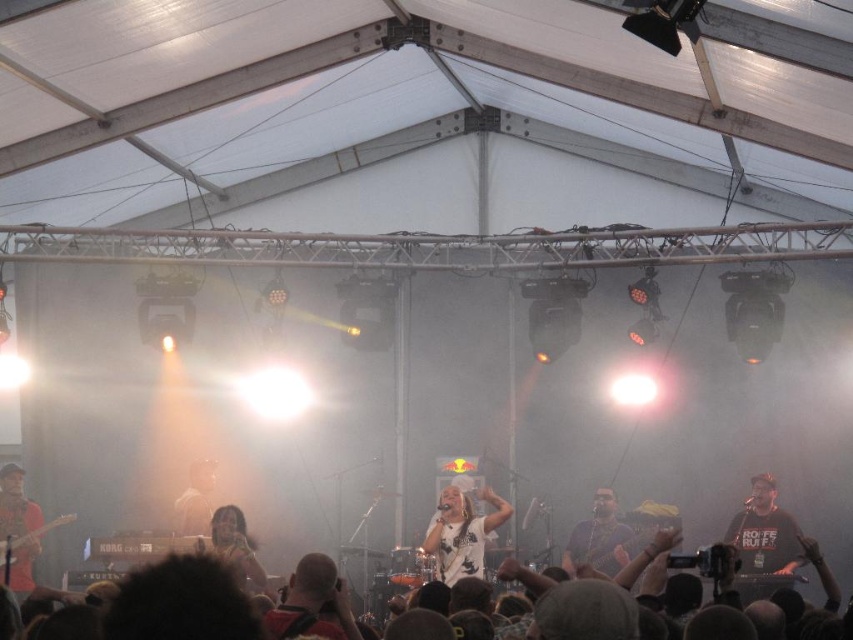
Question: Considering the real-world distances, which object is farthest from the matte black guitar at left?

Choices:
 (A) matte brown shirt at center
 (B) shiny black shirt at center
 (C) matte white shirt at center

Answer: (B)

Question: Can you confirm if shiny black shirt at center is positioned to the left of matte black guitar at left?

Choices:
 (A) no
 (B) yes

Answer: (A)

Question: Which of the following is the closest to the observer?

Choices:
 (A) matte brown shirt at center
 (B) shiny black shirt at center
 (C) matte black guitar at left
 (D) dark gray shirt at center

Answer: (B)

Question: From the image, what is the correct spatial relationship of white fabric shirt at center in relation to dark gray shirt at center?

Choices:
 (A) above
 (B) below

Answer: (A)

Question: Can you confirm if dark gray shirt at center is positioned to the right of matte brown shirt at center?

Choices:
 (A) yes
 (B) no

Answer: (A)

Question: Which object appears closest to the camera in this image?

Choices:
 (A) dark gray shirt at center
 (B) white fabric shirt at center

Answer: (B)